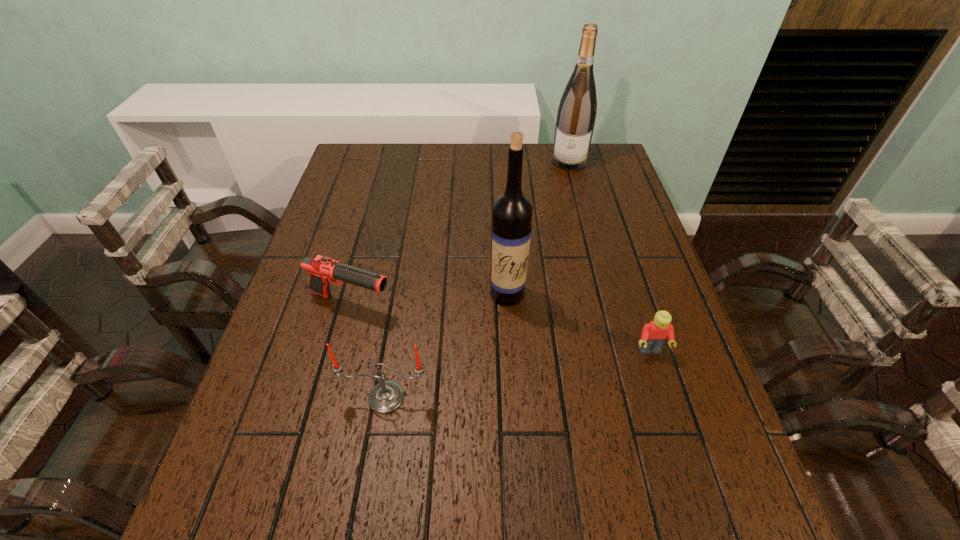
In order to click on vacant area situated 0.280m on the label of the left wine bottle in this screenshot , I will do `click(517, 418)`.

Locate an element on the screen. The width and height of the screenshot is (960, 540). vacant space located 0.330m on the label of the left wine bottle is located at coordinates (520, 443).

The image size is (960, 540). What are the coordinates of `vacant area situated on the label of the left wine bottle` in the screenshot? It's located at (517, 418).

You are a GUI agent. You are given a task and a screenshot of the screen. Output one action in this format:
    pyautogui.click(x=<x>, y=<y>)
    Task: Click on the vacant space located 0.160m on the label of the farther wine bottle
    
    Given the screenshot: What is the action you would take?
    pyautogui.click(x=563, y=199)

Find the location of a particular element. vacant space located on the label of the farther wine bottle is located at coordinates (564, 194).

This screenshot has height=540, width=960. In order to click on free space located on the label of the farther wine bottle in this screenshot , I will do tap(562, 203).

You are a GUI agent. You are given a task and a screenshot of the screen. Output one action in this format:
    pyautogui.click(x=<x>, y=<y>)
    Task: Click on the blank space located at the aiming end of the gun
    
    Given the screenshot: What is the action you would take?
    pyautogui.click(x=418, y=319)

The image size is (960, 540). Identify the location of vacant space located at the aiming end of the gun. (551, 362).

Where is `vacant region located 0.300m at the aiming end of the gun`? This screenshot has width=960, height=540. vacant region located 0.300m at the aiming end of the gun is located at coordinates (512, 349).

Locate an element on the screen. This screenshot has height=540, width=960. object that is at the far edge is located at coordinates (576, 115).